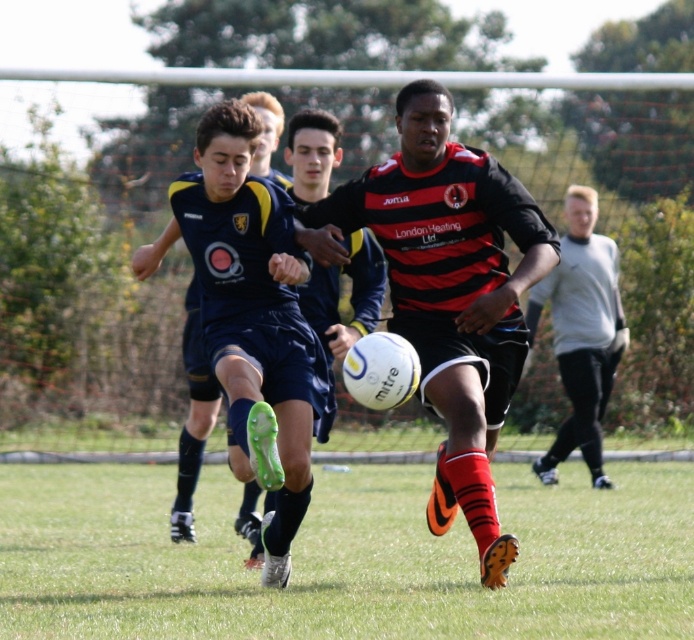
You are a soccer player standing on the field and you see the green grass at center and the light gray fleece at right. Which object is closer to your left side?

The green grass at center is closer to your left side because it is positioned to the left of the light gray fleece at right.

You are a soccer coach observing the match. You notice the green grass at center and the black matte soccer ball at center. Can you determine if the ball is within the penalty area, which has a radius of 10 feet from the center? Explain your reasoning.

The distance between the green grass at center and the black matte soccer ball at center is 6.08 feet. Since the penalty area has a radius of 10 feet from the center, the ball is within the penalty area because 6.08 feet is less than 10 feet.